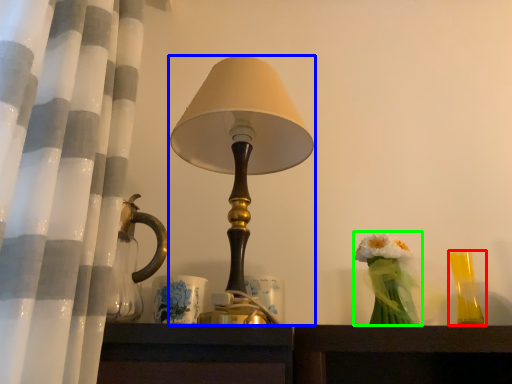
Question: Which object is the farthest from candle holder (highlighted by a red box)? Choose among these: lamp (highlighted by a blue box) or floral arrangement (highlighted by a green box).

Choices:
 (A) lamp
 (B) floral arrangement

Answer: (A)